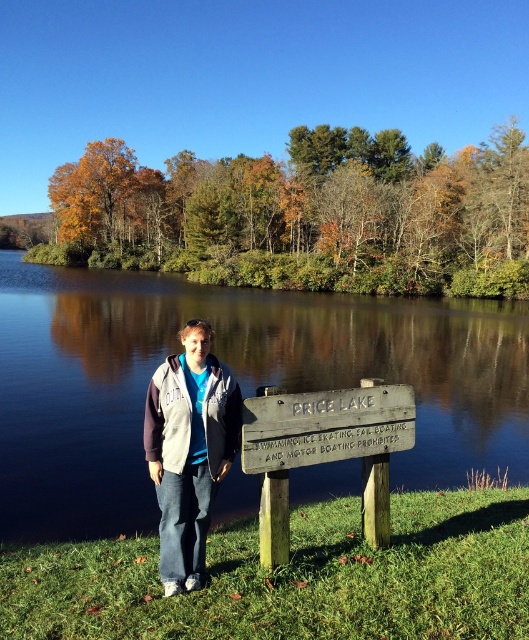
Question: Where is smooth dark water at center located in relation to weathered wood sign at center in the image?

Choices:
 (A) right
 (B) left

Answer: (B)

Question: Does denim jacket at center appear on the right side of weathered wood sign at center?

Choices:
 (A) yes
 (B) no

Answer: (B)

Question: Among these objects, which one is nearest to the camera?

Choices:
 (A) weathered wood sign at center
 (B) denim jacket at center

Answer: (B)

Question: Which point is closer to the camera?

Choices:
 (A) denim jacket at center
 (B) weathered wood sign at center

Answer: (A)

Question: Considering the real-world distances, which object is farthest from the denim jacket at center?

Choices:
 (A) weathered wood sign at center
 (B) smooth dark water at center

Answer: (B)

Question: Does denim jacket at center appear over weathered wood sign at center?

Choices:
 (A) yes
 (B) no

Answer: (B)